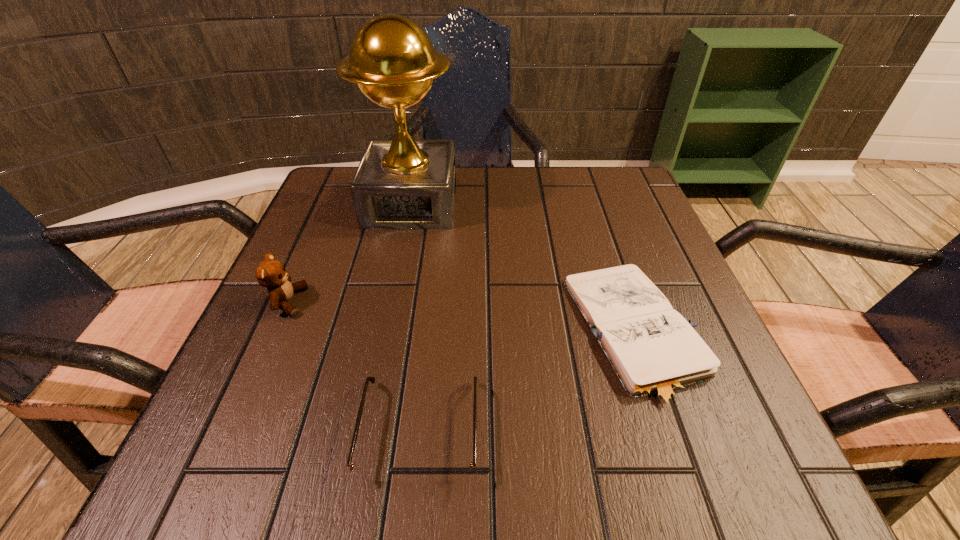
The image size is (960, 540). I want to click on object that is at the far edge, so click(403, 183).

You are a GUI agent. You are given a task and a screenshot of the screen. Output one action in this format:
    pyautogui.click(x=<x>, y=<y>)
    Task: Click on the object present at the near edge
    The height and width of the screenshot is (540, 960).
    Given the screenshot: What is the action you would take?
    pyautogui.click(x=371, y=474)

Locate an element on the screen. award present at the left edge is located at coordinates (403, 183).

Where is `teddy bear that is positioned at the left edge`? teddy bear that is positioned at the left edge is located at coordinates (270, 273).

At what (x,y) coordinates should I click in order to perform the action: click on object present at the right edge. Please return your answer as a coordinate pair (x, y). This screenshot has height=540, width=960. Looking at the image, I should click on (655, 353).

The height and width of the screenshot is (540, 960). Find the location of `object that is at the far left corner`. object that is at the far left corner is located at coordinates coord(403,183).

Identify the location of free region at the far edge. (517, 170).

Where is `vacant position at the near edge of the desktop`? The height and width of the screenshot is (540, 960). vacant position at the near edge of the desktop is located at coordinates (610, 478).

You are a GUI agent. You are given a task and a screenshot of the screen. Output one action in this format:
    pyautogui.click(x=<x>, y=<y>)
    Task: Click on the vacant space at the left edge of the desktop
    
    Given the screenshot: What is the action you would take?
    pyautogui.click(x=245, y=370)

Find the location of `free location at the right edge of the desktop`. free location at the right edge of the desktop is located at coordinates (679, 282).